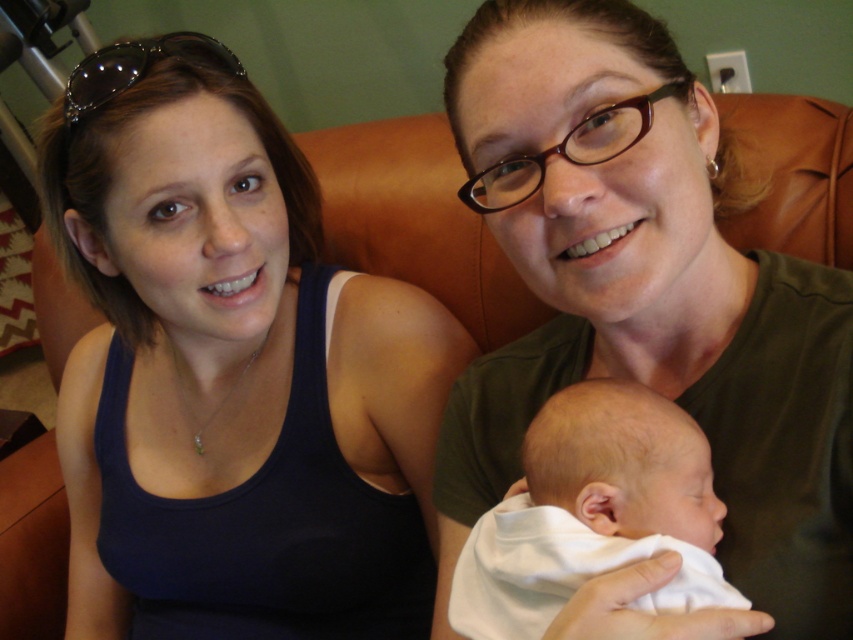
Is matte black tank top at left to the right of green matte shirt at center from the viewer's perspective?

In fact, matte black tank top at left is to the left of green matte shirt at center.

From the picture: Who is positioned more to the right, matte black tank top at left or green matte shirt at center?

green matte shirt at center

The width and height of the screenshot is (853, 640). What do you see at coordinates (231, 371) in the screenshot? I see `matte black tank top at left` at bounding box center [231, 371].

At what (x,y) coordinates should I click in order to perform the action: click on matte black tank top at left. Please return your answer as a coordinate pair (x, y). Looking at the image, I should click on (231, 371).

Consider the image. Which is below, matte black tank top at left or white soft baby at center?

white soft baby at center is lower down.

Consider the image. Which is more to the right, matte black tank top at left or white soft baby at center?

Positioned to the right is white soft baby at center.

Does point (364, 428) come behind point (589, 550)?

That is True.

Find the location of a particular element. matte black tank top at left is located at coordinates (231, 371).

Which of these two, green matte shirt at center or white soft baby at center, stands shorter?

Standing shorter between the two is white soft baby at center.

The image size is (853, 640). Describe the element at coordinates (647, 296) in the screenshot. I see `green matte shirt at center` at that location.

Find the location of a particular element. The width and height of the screenshot is (853, 640). green matte shirt at center is located at coordinates tap(647, 296).